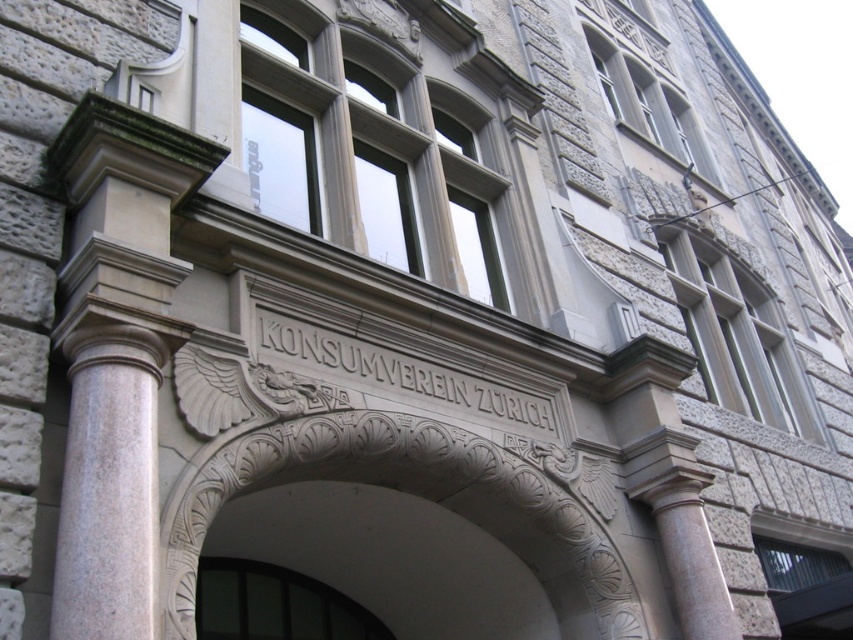
Question: Does white stone engraving at center appear over stone textured window at upper center?

Choices:
 (A) no
 (B) yes

Answer: (A)

Question: Which of the following is the farthest from the observer?

Choices:
 (A) [x=695, y=252]
 (B) [x=393, y=376]

Answer: (A)

Question: Can you confirm if white marble column at left is positioned below white stone arch at center?

Choices:
 (A) no
 (B) yes

Answer: (A)

Question: Which point is closer to the camera?

Choices:
 (A) click(x=355, y=349)
 (B) click(x=337, y=608)
 (C) click(x=183, y=157)
 (D) click(x=271, y=474)

Answer: (C)

Question: Is white marble column at left positioned behind transparent glass door at center?

Choices:
 (A) no
 (B) yes

Answer: (A)

Question: Based on their relative distances, which object is farther from the white marble column at left?

Choices:
 (A) transparent glass door at center
 (B) stone textured window at upper center

Answer: (B)